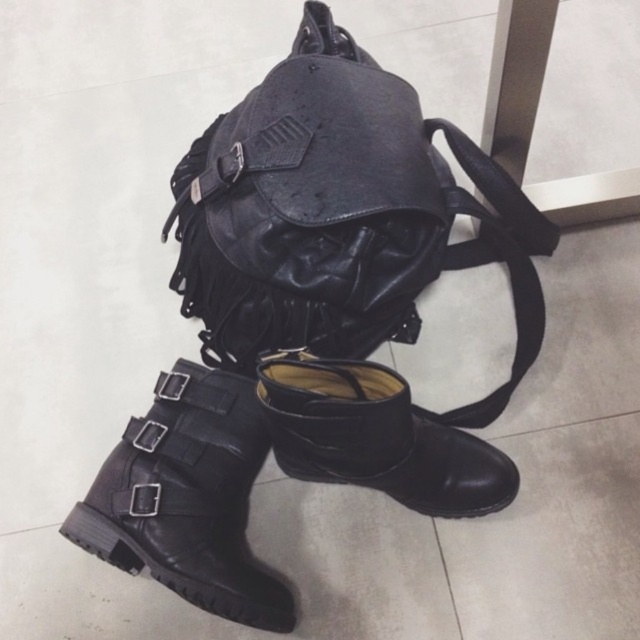
Is point (236, 460) positioned before point (460, 481)?

No, (236, 460) is further to viewer.

Does black leather boot at lower left have a smaller size compared to black leather boot at lower center?

Correct, black leather boot at lower left occupies less space than black leather boot at lower center.

Who is more forward, (193, 531) or (378, 436)?

Point (378, 436) is in front.

Find the location of a particular element. Image resolution: width=640 pixels, height=640 pixels. black leather boot at lower left is located at coordinates (188, 497).